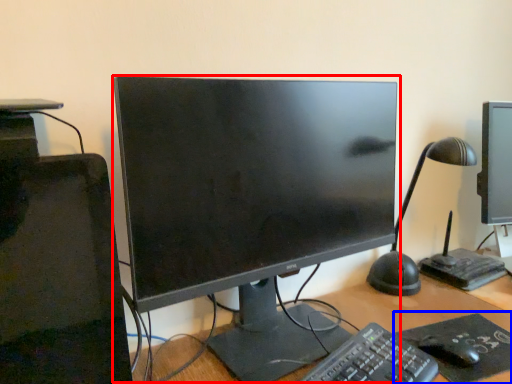
Question: Which point is closer to the camera, computer monitor (highlighted by a red box) or mousepad (highlighted by a blue box)?

Choices:
 (A) computer monitor
 (B) mousepad

Answer: (A)